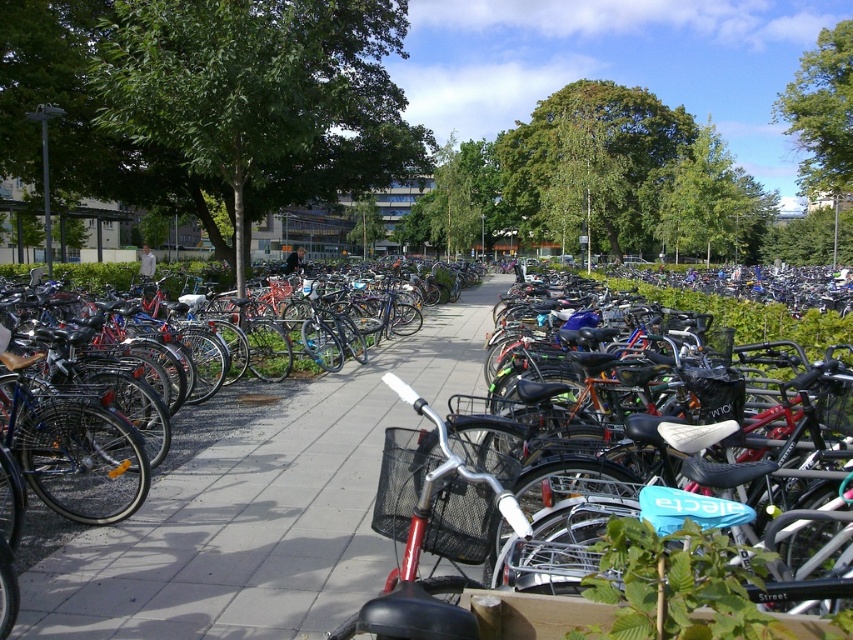
You are a delivery person who needs to place a small box on a surface. You see the gray concrete pavement at center and the matte black bicycle at center. Which surface can you use to place the box without it falling off due to height differences?

The gray concrete pavement at center has a greater height compared to matte black bicycle at center, so placing the box on the gray concrete pavement at center would be more stable as it is higher and less likely to tip over.

You need to place a large picnic blanket on the ground. The matte black bicycle at center is currently occupying some space. Is there enough space on the gray concrete pavement at center to place the picnic blanket without moving the bicycle?

The gray concrete pavement at center is bigger than the matte black bicycle at center, so yes, there is enough space to place the picnic blanket without moving the bicycle.